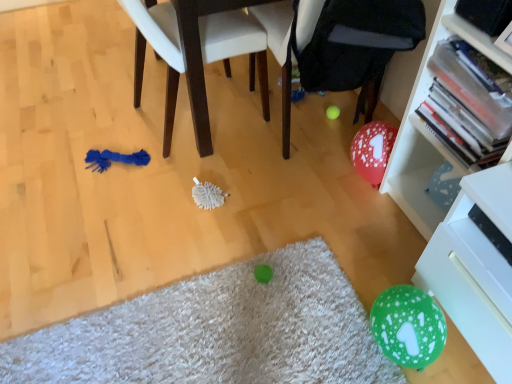
You are a GUI agent. You are given a task and a screenshot of the screen. Output one action in this format:
    pyautogui.click(x=<x>, y=<y>)
    Task: Click on the vacant area that lies between white bristle brush at center and green fuzzy mat at lower center
    
    Given the screenshot: What is the action you would take?
    pyautogui.click(x=180, y=250)